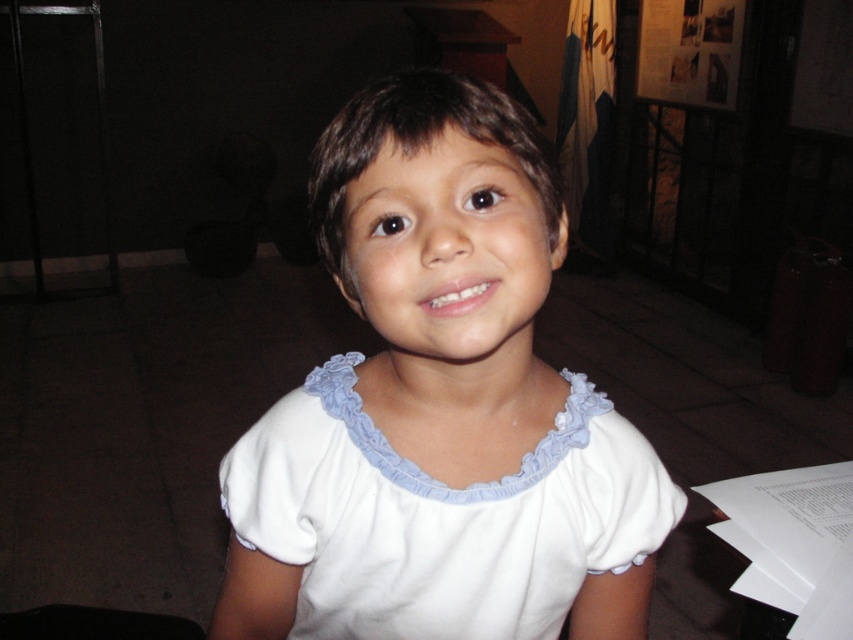
Is point (374, 248) closer to camera compared to point (416, 548)?

Yes.

Can you confirm if white cotton shirt at center is taller than white cotton dress at center?

Yes, white cotton shirt at center is taller than white cotton dress at center.

Where is `white cotton shirt at center`? This screenshot has height=640, width=853. white cotton shirt at center is located at coordinates (440, 406).

Find the location of a particular element. The width and height of the screenshot is (853, 640). white cotton shirt at center is located at coordinates (440, 406).